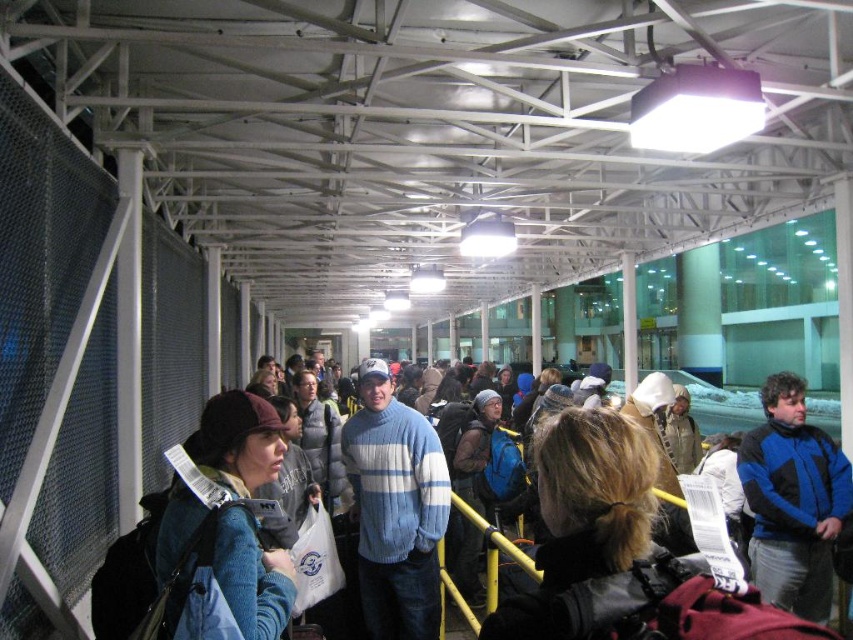
You are standing in the airport waiting area and need to locate the blue fleece jacket at center. According to the spatial coordinates provided, where exactly is the blue fleece jacket positioned in the image?

The blue fleece jacket at center is located at point coordinates of 0.783 along the horizontal axis and 0.930 along the vertical axis.

You are a photographer standing in the airport waiting area. You want to take a photo of both the blue fleece jacket at center and the blue woolen sweater at center. Which one should you focus on first to ensure they are both in frame?

The blue fleece jacket at center is much taller than the blue woolen sweater at center, so you should focus on the blue fleece jacket at center first to ensure both are in frame.